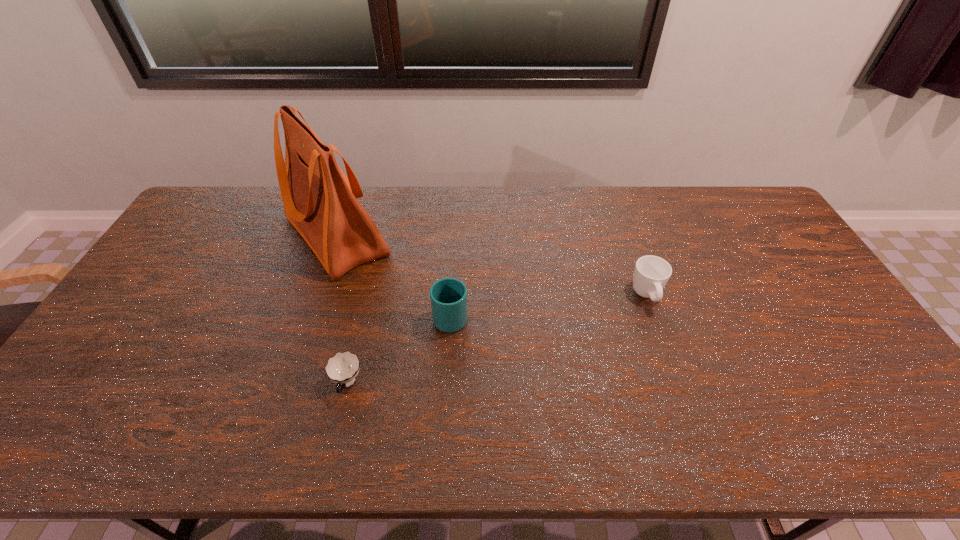
This screenshot has width=960, height=540. In order to click on shopping bag in this screenshot , I will do `click(319, 200)`.

Image resolution: width=960 pixels, height=540 pixels. I want to click on the third shortest object, so click(x=448, y=296).

Locate an element on the screen. the second cup from left to right is located at coordinates (448, 296).

Identify the location of the third tallest object. (651, 273).

You are a GUI agent. You are given a task and a screenshot of the screen. Output one action in this format:
    pyautogui.click(x=<x>, y=<y>)
    Task: Click on the second shortest cup
    This screenshot has width=960, height=540.
    Given the screenshot: What is the action you would take?
    pyautogui.click(x=651, y=273)

This screenshot has width=960, height=540. I want to click on the nearest object, so click(342, 368).

Locate an element on the screen. the shortest cup is located at coordinates (342, 368).

The width and height of the screenshot is (960, 540). Find the location of `vacant space situated 0.320m on the left of the tallest object`. vacant space situated 0.320m on the left of the tallest object is located at coordinates (181, 236).

This screenshot has width=960, height=540. Identify the location of vacant space located on the handle side of the second object from right to left. tap(455, 246).

Find the location of `blank space located 0.170m on the handle side of the second object from right to left`. blank space located 0.170m on the handle side of the second object from right to left is located at coordinates (454, 258).